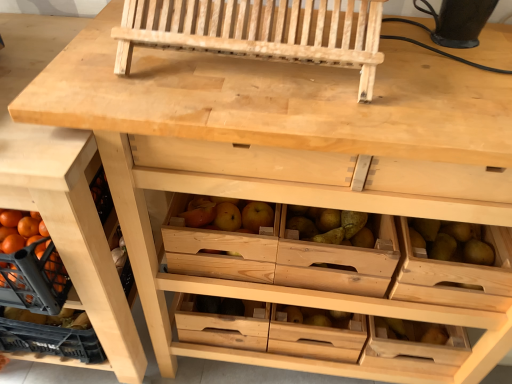
At what (x,y) coordinates should I click in order to perform the action: click on vacant area that lies to the right of natural wood church bench at upper center. Please return your answer as a coordinate pair (x, y). Looking at the image, I should click on (437, 80).